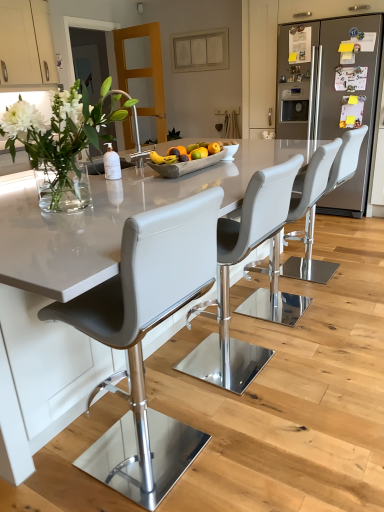
Locate an element on the screen. This screenshot has height=512, width=384. free point in front of gray leather bar stool at center, the 2th chair in the back-to-front sequence is located at coordinates (310, 343).